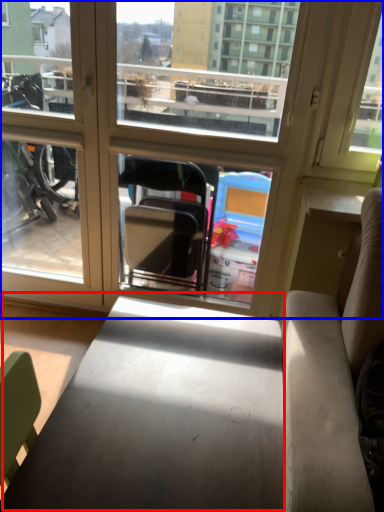
Question: Which point is closer to the camera, table (highlighted by a red box) or window (highlighted by a blue box)?

Choices:
 (A) table
 (B) window

Answer: (A)